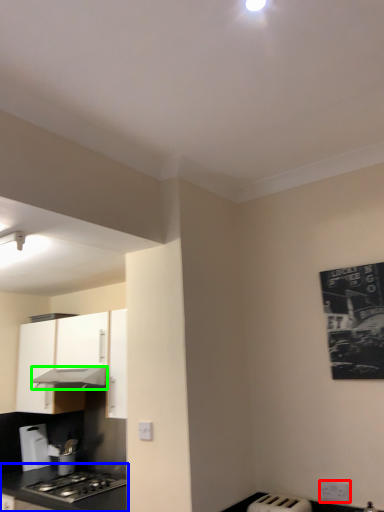
Question: Based on their relative distances, which object is farther from electric outlet (highlighted by a red box)? Choose from countertop (highlighted by a blue box) and exhaust hood (highlighted by a green box).

Choices:
 (A) countertop
 (B) exhaust hood

Answer: (B)